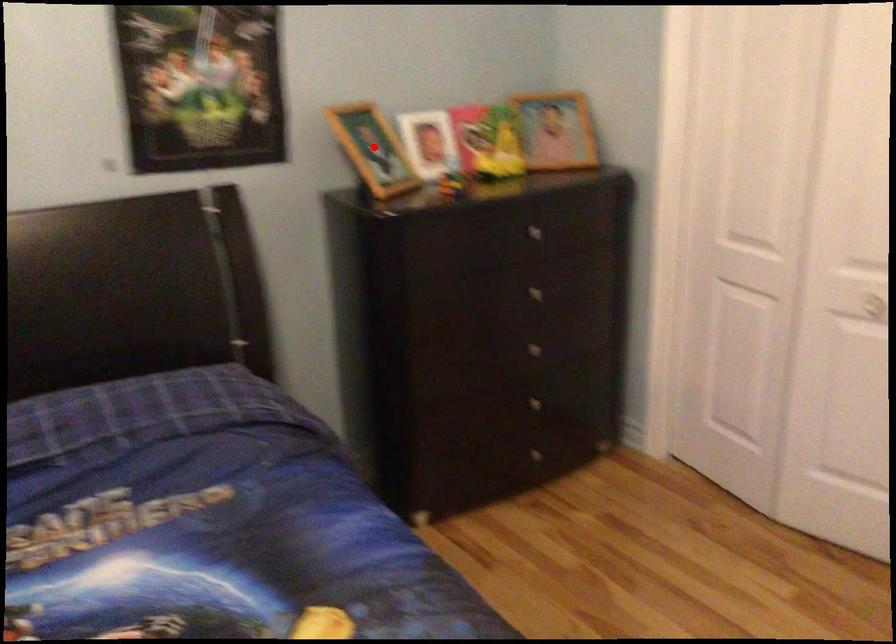
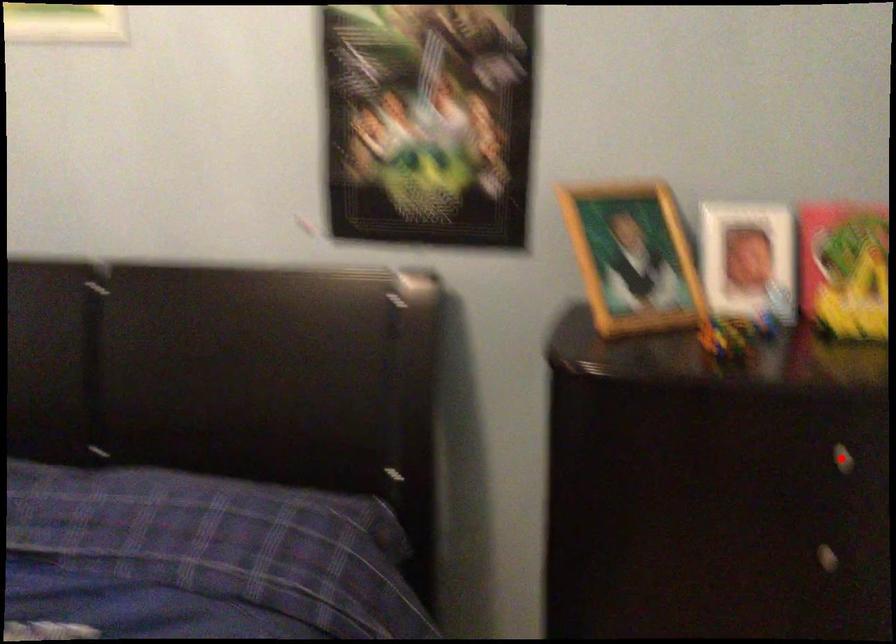
I am providing you with two images of the same scene from different viewpoints. A red point is marked on the first image and another point is marked on the second image. Does the point marked in image1 correspond to the same location as the one in image2?

No